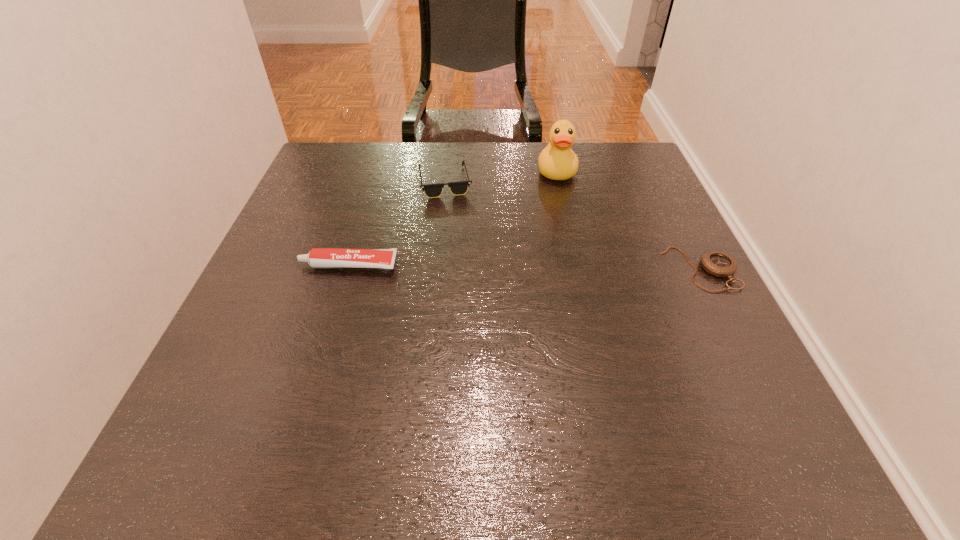
This screenshot has width=960, height=540. In order to click on vacant space on the desktop that is between the toothpaste and the pocket watch and is positioned on the lenses of the second object from left to right in this screenshot , I will do `click(551, 267)`.

Where is `vacant space on the desktop that is between the leftmost object and the shortest object and is positioned at the beak of the second object from right to left`? vacant space on the desktop that is between the leftmost object and the shortest object and is positioned at the beak of the second object from right to left is located at coordinates (564, 267).